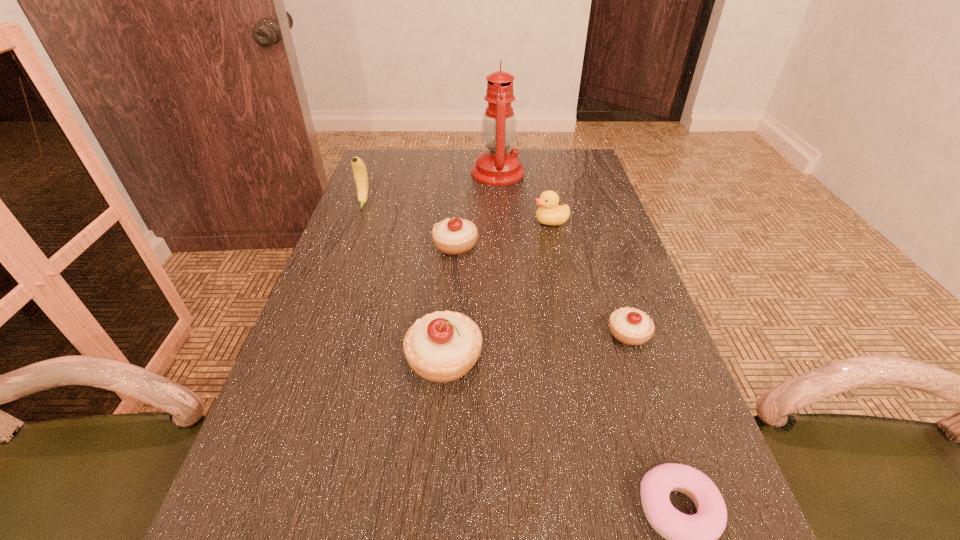
Locate an element on the screen. object that is at the far edge is located at coordinates (498, 166).

Where is `object at the left edge`? object at the left edge is located at coordinates (359, 169).

Locate an element on the screen. duckling located at the right edge is located at coordinates (549, 213).

Identify the location of pastry at the right edge. Image resolution: width=960 pixels, height=540 pixels. (630, 326).

The width and height of the screenshot is (960, 540). In the image, there is a desktop. What are the coordinates of `vacant space at the far edge` in the screenshot? It's located at point(428,160).

What are the coordinates of `vacant space at the left edge of the desktop` in the screenshot? It's located at (322, 308).

Image resolution: width=960 pixels, height=540 pixels. In order to click on vacant region at the right edge of the desktop in this screenshot , I will do `click(592, 317)`.

The image size is (960, 540). In order to click on vacant space at the far left corner of the desktop in this screenshot , I will do `click(413, 159)`.

The image size is (960, 540). What are the coordinates of `unoccupied area between the rightmost beige pastry and the yellow duckling` in the screenshot? It's located at (589, 277).

This screenshot has width=960, height=540. Identify the location of free point between the farthest object and the second tallest object. (431, 188).